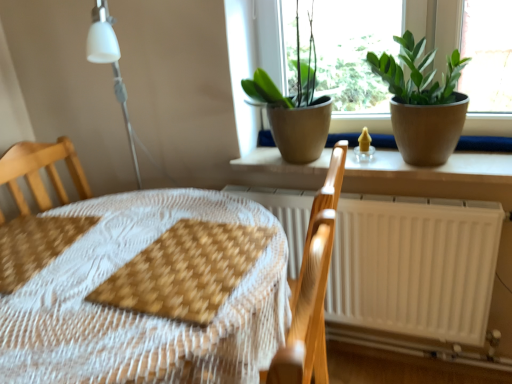
Question: Should I look upward or downward to see brown woven placemat at center, which is the first sheet in right-to-left order?

Choices:
 (A) down
 (B) up

Answer: (A)

Question: From the image's perspective, would you say wooden placemat at center is shown under brown woven placemat at lower left, placed as the first sheet when sorted from left to right?

Choices:
 (A) yes
 (B) no

Answer: (A)

Question: Does wooden placemat at center have a lesser width compared to brown woven placemat at lower left, placed as the first sheet when sorted from left to right?

Choices:
 (A) no
 (B) yes

Answer: (A)

Question: From a real-world perspective, is wooden placemat at center below brown woven placemat at lower left, placed as the first sheet when sorted from left to right?

Choices:
 (A) yes
 (B) no

Answer: (A)

Question: Is brown woven placemat at lower left, placed as the first sheet when sorted from left to right, a part of wooden placemat at center?

Choices:
 (A) no
 (B) yes

Answer: (B)

Question: Considering the relative positions of wooden placemat at center and brown woven placemat at lower left, placed as the first sheet when sorted from left to right, in the image provided, is wooden placemat at center to the right of brown woven placemat at lower left, placed as the first sheet when sorted from left to right, from the viewer's perspective?

Choices:
 (A) yes
 (B) no

Answer: (A)

Question: Is wooden placemat at center not near brown woven placemat at lower left, placed as the first sheet when sorted from left to right?

Choices:
 (A) no
 (B) yes

Answer: (A)

Question: Is matte yellow candle holder at center located within brown woven placemat at center, arranged as the 2th sheet when viewed from the left?

Choices:
 (A) yes
 (B) no

Answer: (B)

Question: Can you confirm if brown woven placemat at center, which is the first sheet in right-to-left order, is positioned to the right of matte yellow candle holder at center?

Choices:
 (A) no
 (B) yes

Answer: (A)

Question: Can you confirm if brown woven placemat at center, which is the first sheet in right-to-left order, is wider than matte yellow candle holder at center?

Choices:
 (A) yes
 (B) no

Answer: (A)

Question: Can you confirm if brown woven placemat at center, which is the first sheet in right-to-left order, is thinner than matte yellow candle holder at center?

Choices:
 (A) yes
 (B) no

Answer: (B)

Question: From the image's perspective, would you say brown woven placemat at center, arranged as the 2th sheet when viewed from the left, is shown under matte yellow candle holder at center?

Choices:
 (A) no
 (B) yes

Answer: (B)

Question: From a real-world perspective, is brown woven placemat at center, which is the first sheet in right-to-left order, positioned under matte yellow candle holder at center based on gravity?

Choices:
 (A) yes
 (B) no

Answer: (A)

Question: Is green matte plant at upper center, which appears as the first houseplant when viewed from the left, oriented towards brown woven placemat at lower left, placed as the first sheet when sorted from left to right?

Choices:
 (A) no
 (B) yes

Answer: (A)